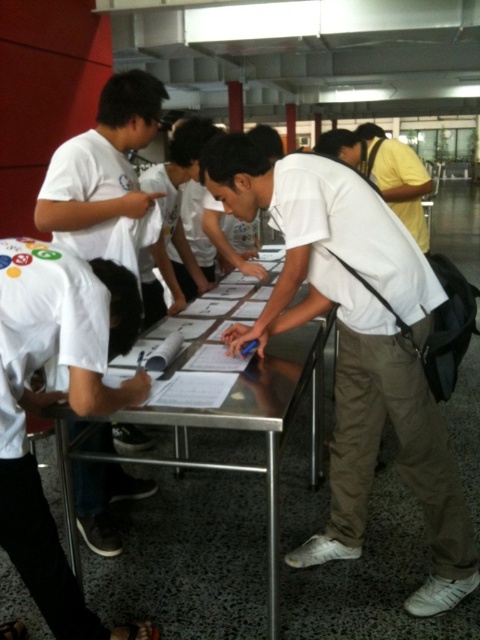
Does white matte shirt at center have a larger size compared to white matte shirt at left?

Yes.

Does white matte shirt at center come behind white matte shirt at left?

No, it is not.

This screenshot has width=480, height=640. Identify the location of white matte shirt at center. (355, 346).

Between white matte shirt at left and metallic silver table at center, which one appears on the left side from the viewer's perspective?

white matte shirt at left

Does white matte shirt at left appear on the right side of metallic silver table at center?

No, white matte shirt at left is not to the right of metallic silver table at center.

The width and height of the screenshot is (480, 640). What are the coordinates of `white matte shirt at left` in the screenshot? It's located at (105, 176).

Where is `white matte shirt at left`? This screenshot has height=640, width=480. white matte shirt at left is located at coordinates (105, 176).

Does point (146, 86) lie in front of point (368, 164)?

Yes.

Between white matte shirt at left and yellow cotton shirt at upper right, which one is positioned higher?

Positioned higher is yellow cotton shirt at upper right.

The image size is (480, 640). Describe the element at coordinates (105, 176) in the screenshot. I see `white matte shirt at left` at that location.

Find the location of a particular element. Image resolution: width=480 pixels, height=640 pixels. white matte shirt at left is located at coordinates (105, 176).